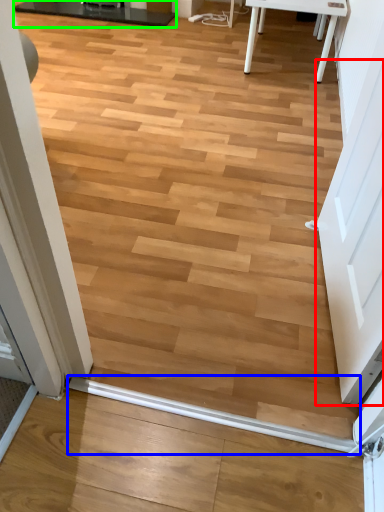
Question: Based on their relative distances, which object is farther from screen door (highlighted by a red box)? Choose from beam (highlighted by a blue box) and table (highlighted by a green box).

Choices:
 (A) beam
 (B) table

Answer: (B)